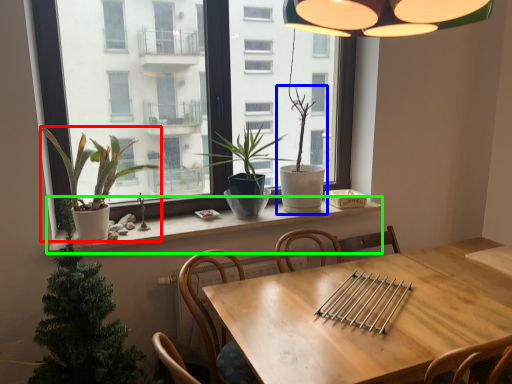
Question: Considering the real-world distances, which object is farthest from houseplant (highlighted by a red box)? houseplant (highlighted by a blue box) or window sill (highlighted by a green box)?

Choices:
 (A) houseplant
 (B) window sill

Answer: (A)